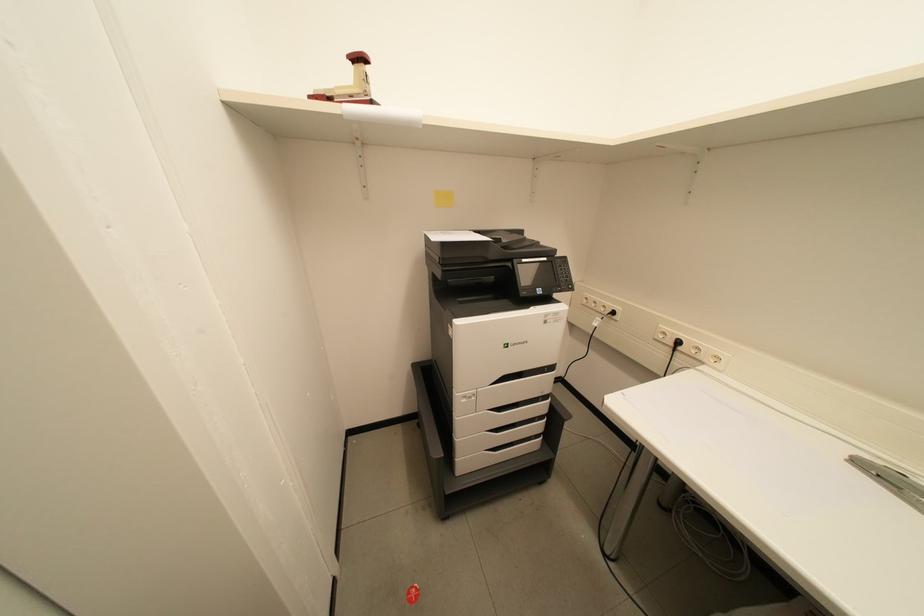
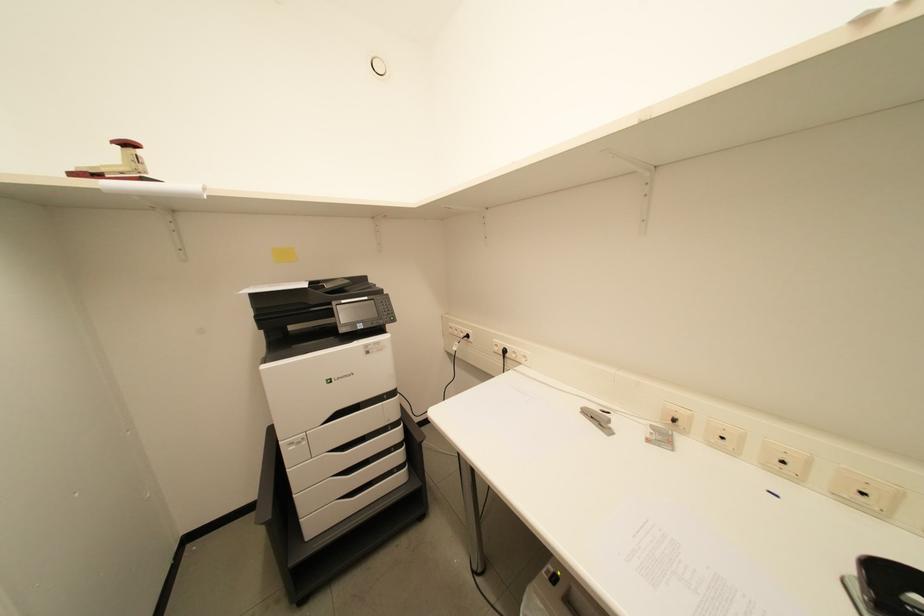
The images are taken continuously from a first-person perspective. In which direction are you moving?

The movement direction of the cameraman is right, backward.